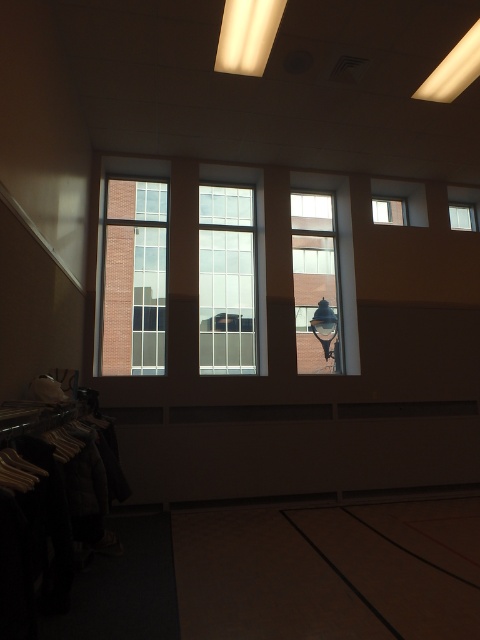
Question: Which point appears closest to the camera in this image?

Choices:
 (A) (396, 218)
 (B) (115, 268)
 (C) (216, 252)

Answer: (B)

Question: Can you confirm if brick wall at left is positioned to the left of clear glass window at center?

Choices:
 (A) no
 (B) yes

Answer: (B)

Question: Is brick wall at left to the right of clear glass window at upper right from the viewer's perspective?

Choices:
 (A) yes
 (B) no

Answer: (B)

Question: Observing the image, what is the correct spatial positioning of matte glass window at center in reference to clear glass window at upper right?

Choices:
 (A) right
 (B) left

Answer: (B)

Question: Which point is farther from the camera taking this photo?

Choices:
 (A) (134, 342)
 (B) (405, 209)
 (C) (456, 212)

Answer: (C)

Question: Among these objects, which one is nearest to the camera?

Choices:
 (A) clear glass window at upper right
 (B) clear glass window at left

Answer: (B)